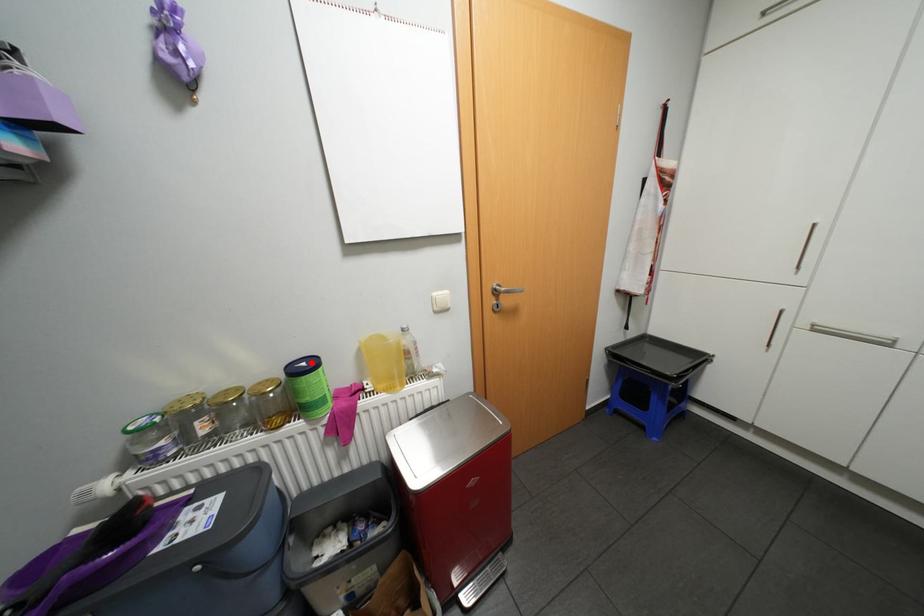
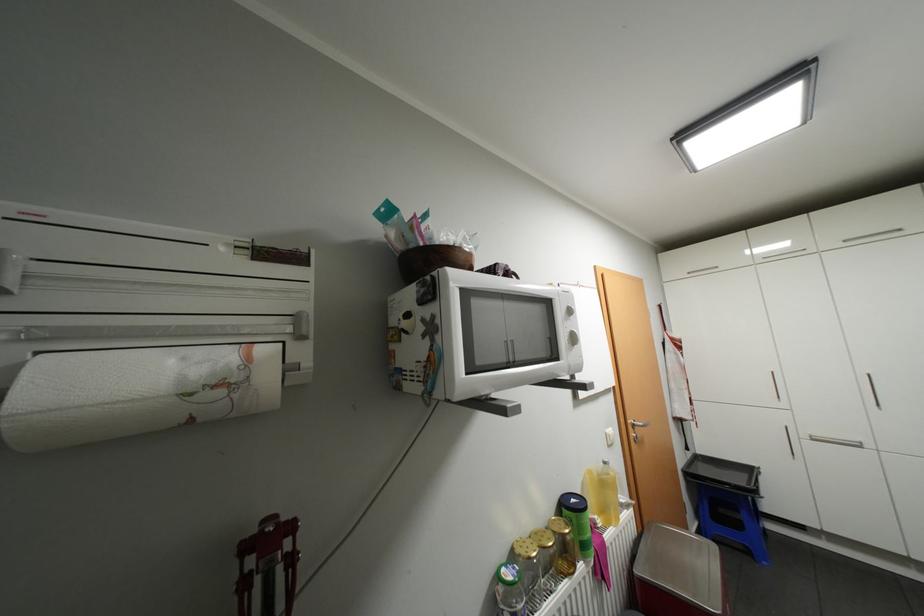
Where in the second image is the point corresponding to the highlighted location from the first image?

(580, 499)